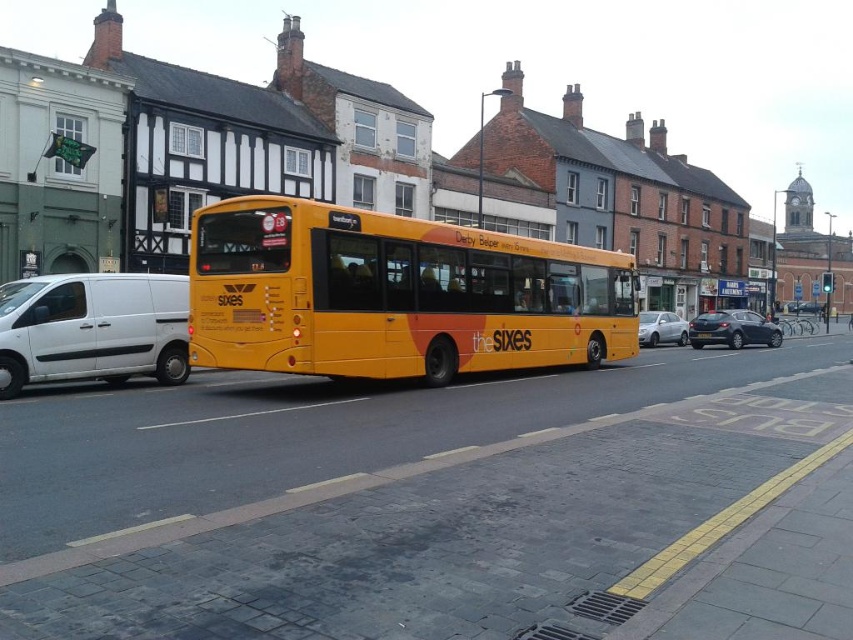
You are a pedestrian standing on the pavement. You notice a silver metallic sedan at center and a yellow matte license plate at center. Which object is taller?

The silver metallic sedan at center is taller than the yellow matte license plate at center.

You are a pedestrian standing on the pavement next to the road. You see a silver metallic sedan at center and a yellow matte license plate at center. Which object is closer to the road median strip?

The yellow matte license plate at center is closer to the road median strip because the silver metallic sedan at center is to the right of the yellow matte license plate at center, meaning the sedan is farther from the median strip compared to the license plate.

You are a delivery person who needs to park your vehicle between the white matte van at left and the dark gray metallic car at right. Your delivery van is 2.2 meters wide. Can you fit your van between them without touching either vehicle?

The white matte van at left is narrower than the dark gray metallic car at right. However, the exact distance between them isn